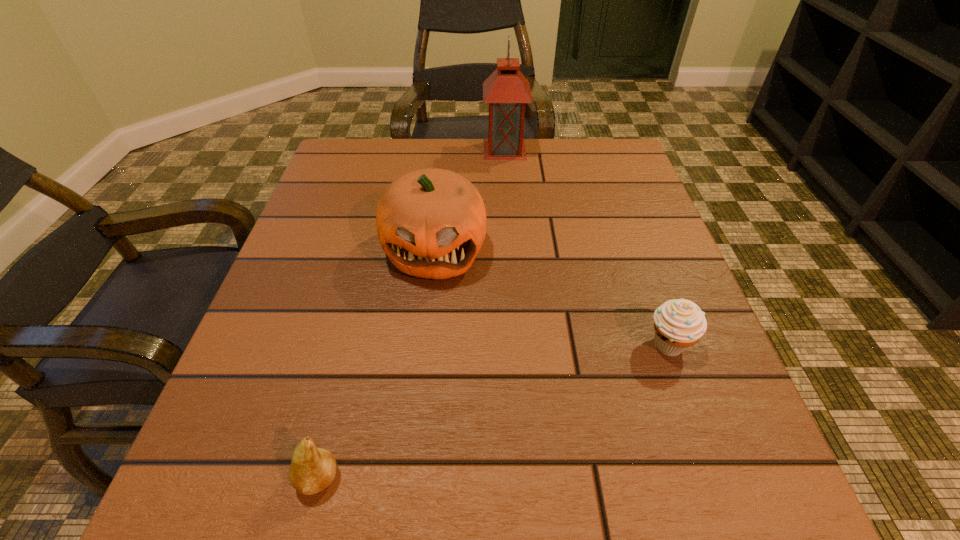
Identify the location of vacant area situated on the left of the nearest object. This screenshot has width=960, height=540. (228, 478).

You are a GUI agent. You are given a task and a screenshot of the screen. Output one action in this format:
    pyautogui.click(x=<x>, y=<y>)
    Task: Click on the object at the far edge
    This screenshot has width=960, height=540.
    Given the screenshot: What is the action you would take?
    pyautogui.click(x=506, y=90)

Image resolution: width=960 pixels, height=540 pixels. I want to click on object located at the near edge, so click(312, 469).

This screenshot has width=960, height=540. In order to click on object that is at the left edge in this screenshot , I will do `click(312, 469)`.

The width and height of the screenshot is (960, 540). In order to click on object present at the right edge in this screenshot , I will do `click(678, 323)`.

The height and width of the screenshot is (540, 960). I want to click on object that is at the near left corner, so click(312, 469).

This screenshot has width=960, height=540. I want to click on vacant space at the far edge, so click(x=522, y=164).

You are a GUI agent. You are given a task and a screenshot of the screen. Output one action in this format:
    pyautogui.click(x=<x>, y=<y>)
    Task: Click on the blank area at the near edge
    Image resolution: width=960 pixels, height=540 pixels.
    Given the screenshot: What is the action you would take?
    pyautogui.click(x=521, y=458)

This screenshot has height=540, width=960. In the image, there is a desktop. Identify the location of free space at the left edge. (351, 281).

Locate an element on the screen. This screenshot has width=960, height=540. vacant area at the far left corner is located at coordinates (392, 139).